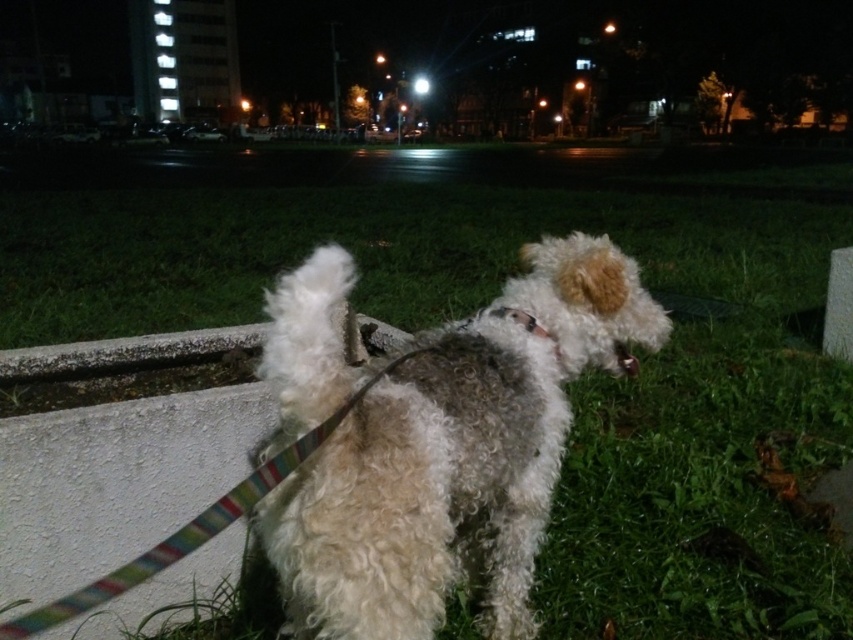
Question: Does curly fur dog at center appear over white fabric neckband at center?

Choices:
 (A) no
 (B) yes

Answer: (A)

Question: Which object appears closest to the camera in this image?

Choices:
 (A) white fabric neckband at center
 (B) curly fur dog at center

Answer: (B)

Question: Is curly fur dog at center behind white fabric neckband at center?

Choices:
 (A) no
 (B) yes

Answer: (A)

Question: Which object appears farthest from the camera in this image?

Choices:
 (A) curly fur dog at center
 (B) white fabric neckband at center

Answer: (B)

Question: In this image, where is curly fur dog at center located relative to white fabric neckband at center?

Choices:
 (A) left
 (B) right

Answer: (A)

Question: Among these objects, which one is nearest to the camera?

Choices:
 (A) white fabric neckband at center
 (B) curly fur dog at center

Answer: (B)